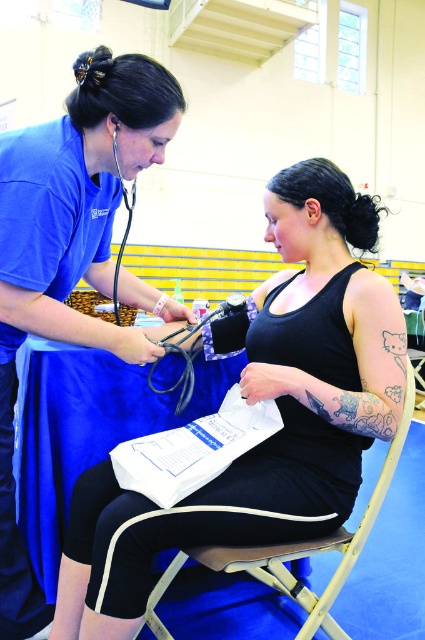
Between metallic silver chair at center and black rubber stethoscope at center, which one has more height?

With more height is metallic silver chair at center.

Can you confirm if metallic silver chair at center is positioned below black rubber stethoscope at center?

Indeed, metallic silver chair at center is positioned under black rubber stethoscope at center.

This screenshot has width=425, height=640. I want to click on metallic silver chair at center, so click(x=295, y=552).

Is point (113, 586) in front of point (263, 556)?

Yes.

Identify the location of black matte tank top at center. The image size is (425, 640). (261, 400).

Between point (19, 294) and point (221, 348), which one is positioned in front?

Positioned in front is point (19, 294).

Is point (147, 349) more distant than point (220, 349)?

That is False.

You are a GUI agent. You are given a task and a screenshot of the screen. Output one action in this format:
    pyautogui.click(x=<x>, y=<y>)
    Task: Click on the matte blue shirt at upper left
    The image size is (425, 640).
    Given the screenshot: What is the action you would take?
    pyautogui.click(x=68, y=252)